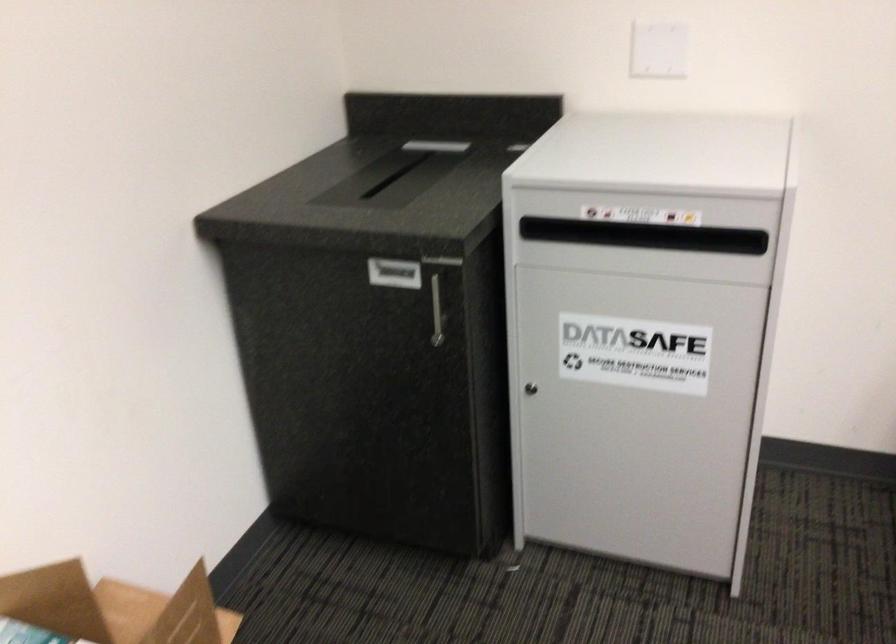
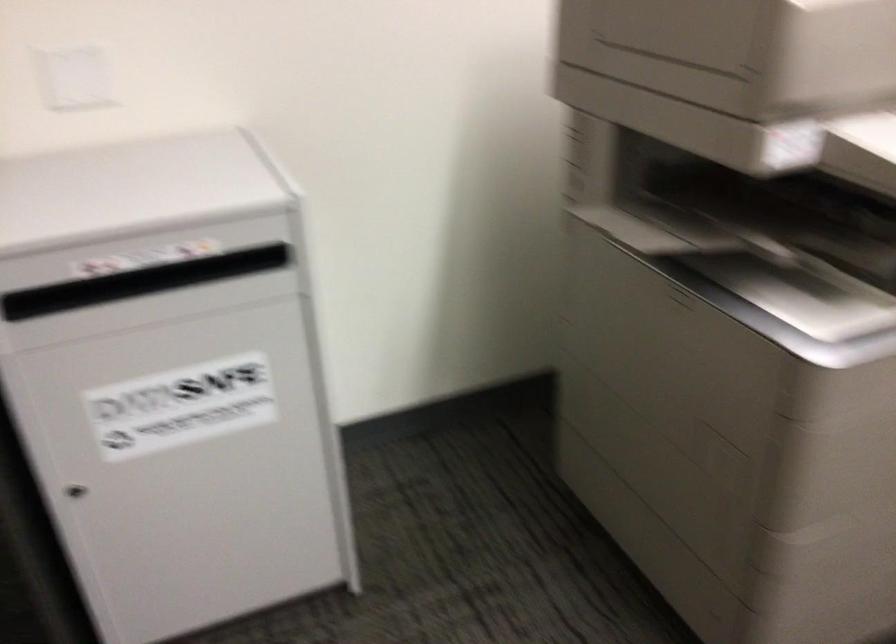
Question: Based on the continuous images, in which direction is the camera rotating? Reply with the corresponding letter.

Choices:
 (A) Left
 (B) Right
 (C) Up
 (D) Down

Answer: (B)